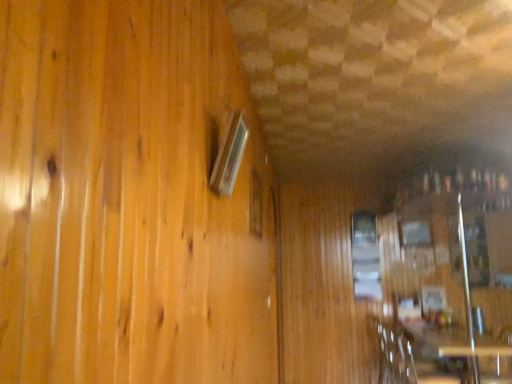
Question: Considering the positions of wooden table at lower right, marked as the second table in a back-to-front arrangement, and clear glass window at upper center, which appears as the 2th window when viewed from the right, in the image, is wooden table at lower right, marked as the second table in a back-to-front arrangement, wider or thinner than clear glass window at upper center, which appears as the 2th window when viewed from the right,?

Choices:
 (A) thin
 (B) wide

Answer: (B)

Question: Considering the positions of wooden table at lower right, marked as the second table in a back-to-front arrangement, and clear glass window at upper center, arranged as the second window when viewed from the top, in the image, is wooden table at lower right, marked as the second table in a back-to-front arrangement, taller or shorter than clear glass window at upper center, arranged as the second window when viewed from the top,?

Choices:
 (A) tall
 (B) short

Answer: (A)

Question: Estimate the real-world distances between objects in this image. Which object is farther from the clear glass window at upper center, which appears as the 2th window when viewed from the right?

Choices:
 (A) wooden armchair at lower right
 (B) wooden table at lower right, which is the first table in front-to-back order
 (C) matte glass window at upper left, which is counted as the third window, starting from the back
 (D) transparent glass table at lower right, marked as the first table in a back-to-front arrangement
 (E) clear glass window at center, which is the first window from right to left

Answer: (D)

Question: Which is nearer to the wooden armchair at lower right?

Choices:
 (A) clear glass window at upper center, which appears as the 2th window when viewed from the right
 (B) wooden table at lower right, marked as the second table in a back-to-front arrangement
 (C) matte glass window at upper left, positioned as the third window in right-to-left order
 (D) clear glass window at center, the 3th window in the left-to-right sequence
 (E) transparent glass table at lower right, marked as the first table in a back-to-front arrangement

Answer: (B)